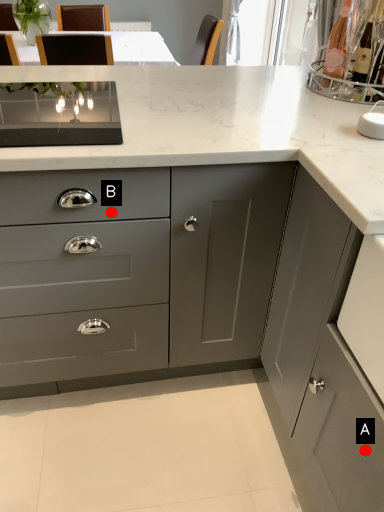
Question: Two points are circled on the image, labeled by A and B beside each circle. Which point is further to the camera?

Choices:
 (A) A is further
 (B) B is further

Answer: (B)